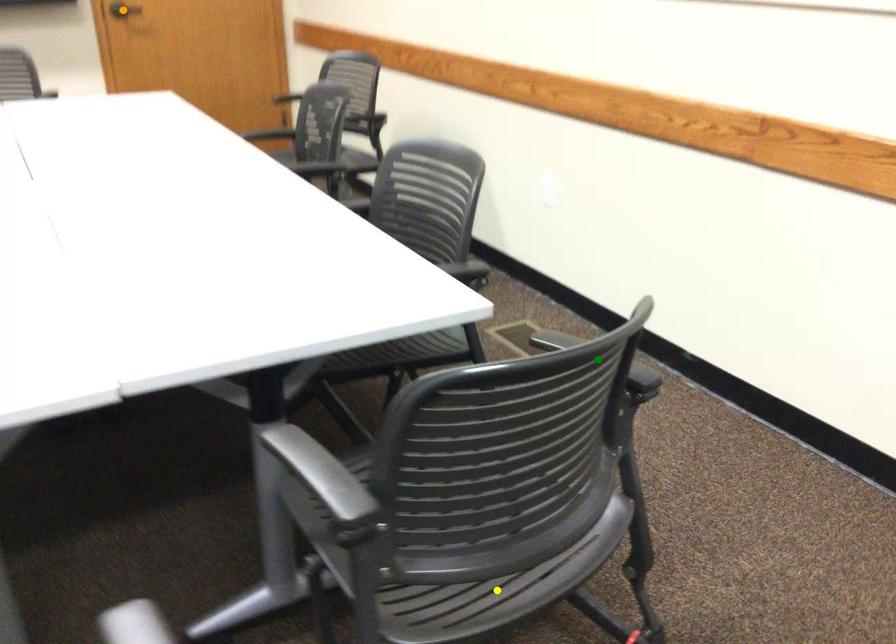
Order these from nearest to farthest:
1. yellow point
2. green point
3. orange point

green point
yellow point
orange point